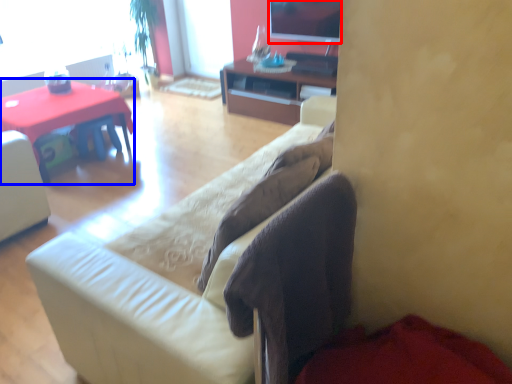
Question: Which object appears closest to the camera in this image, television (highlighted by a red box) or desk (highlighted by a blue box)?

Choices:
 (A) television
 (B) desk

Answer: (B)